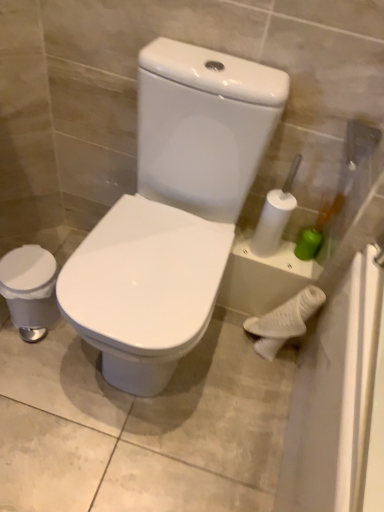
Question: Can you confirm if white glossy trash can at left, arranged as the 3th porcelain when viewed from the right, is wider than white glossy toilet at center, placed as the second porcelain when sorted from left to right?

Choices:
 (A) no
 (B) yes

Answer: (A)

Question: Is white glossy trash can at left, arranged as the 3th porcelain when viewed from the right, further to camera compared to white glossy toilet at center, placed as the second porcelain when sorted from left to right?

Choices:
 (A) no
 (B) yes

Answer: (B)

Question: From the image's perspective, does white glossy trash can at left, arranged as the 3th porcelain when viewed from the right, appear higher than white glossy toilet at center, placed as the second porcelain when sorted from left to right?

Choices:
 (A) no
 (B) yes

Answer: (A)

Question: Is white glossy trash can at left, the 1th porcelain in the left-to-right sequence, to the right of white glossy toilet at center, arranged as the 2th porcelain when viewed from the right, from the viewer's perspective?

Choices:
 (A) yes
 (B) no

Answer: (B)

Question: Is white glossy toilet at center, arranged as the 2th porcelain when viewed from the right, a part of white glossy trash can at left, arranged as the 3th porcelain when viewed from the right?

Choices:
 (A) yes
 (B) no

Answer: (B)

Question: Visually, is white glossy toilet at center, arranged as the 2th porcelain when viewed from the right, positioned to the left or to the right of white matte porcelain at lower right, marked as the 3th porcelain in a left-to-right arrangement?

Choices:
 (A) right
 (B) left

Answer: (B)

Question: Considering the positions of white glossy toilet at center, arranged as the 2th porcelain when viewed from the right, and white matte porcelain at lower right, acting as the 1th porcelain starting from the right, in the image, is white glossy toilet at center, arranged as the 2th porcelain when viewed from the right, bigger or smaller than white matte porcelain at lower right, acting as the 1th porcelain starting from the right,?

Choices:
 (A) small
 (B) big

Answer: (B)

Question: From a real-world perspective, is white glossy toilet at center, placed as the second porcelain when sorted from left to right, positioned above or below white matte porcelain at lower right, acting as the 1th porcelain starting from the right?

Choices:
 (A) below
 (B) above

Answer: (B)

Question: Is white glossy toilet at center, placed as the second porcelain when sorted from left to right, in front of or behind white matte porcelain at lower right, marked as the 3th porcelain in a left-to-right arrangement, in the image?

Choices:
 (A) behind
 (B) front

Answer: (B)

Question: From the image's perspective, is white glossy toilet at center, arranged as the 2th porcelain when viewed from the right, above or below white glossy trash can at left, arranged as the 3th porcelain when viewed from the right?

Choices:
 (A) above
 (B) below

Answer: (A)

Question: Is white glossy toilet at center, placed as the second porcelain when sorted from left to right, in front of or behind white glossy trash can at left, the 1th porcelain in the left-to-right sequence, in the image?

Choices:
 (A) front
 (B) behind

Answer: (A)

Question: Is white glossy toilet at center, arranged as the 2th porcelain when viewed from the right, bigger or smaller than white glossy trash can at left, the 1th porcelain in the left-to-right sequence?

Choices:
 (A) small
 (B) big

Answer: (B)

Question: In terms of height, does white glossy toilet at center, placed as the second porcelain when sorted from left to right, look taller or shorter compared to white glossy trash can at left, arranged as the 3th porcelain when viewed from the right?

Choices:
 (A) tall
 (B) short

Answer: (A)

Question: Is white matte porcelain at lower right, acting as the 1th porcelain starting from the right, to the left or to the right of white glossy toilet at center, placed as the second porcelain when sorted from left to right, in the image?

Choices:
 (A) right
 (B) left

Answer: (A)

Question: From the image's perspective, is white matte porcelain at lower right, acting as the 1th porcelain starting from the right, located above or below white glossy toilet at center, arranged as the 2th porcelain when viewed from the right?

Choices:
 (A) above
 (B) below

Answer: (B)